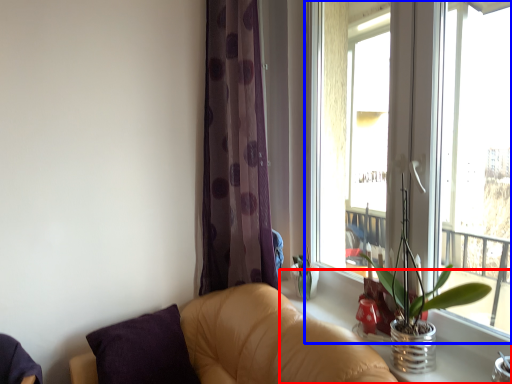
Question: Which object is closer to the camera taking this photo, window sill (highlighted by a red box) or window (highlighted by a blue box)?

Choices:
 (A) window sill
 (B) window

Answer: (B)